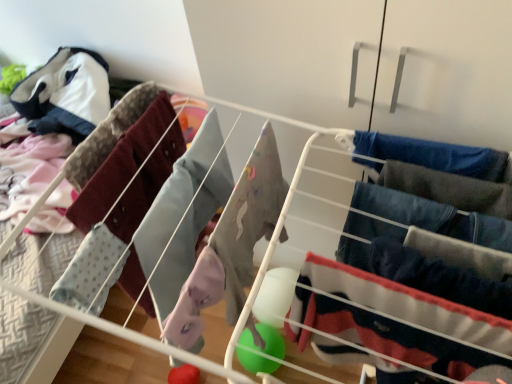
The image size is (512, 384). Describe the element at coordinates (399, 318) in the screenshot. I see `velvet navy pants at center right, placed as the 2th clothing when sorted from left to right` at that location.

You are a GUI agent. You are given a task and a screenshot of the screen. Output one action in this format:
    pyautogui.click(x=<x>, y=<y>)
    Task: Click on the velvet navy pants at center right, the 3th clothing positioned from the right
    The image size is (512, 384).
    Given the screenshot: What is the action you would take?
    [399, 318]

From the image's perspective, is denim jeans at right, which is the 3th clothing from left to right, located beneath velvet navy pants at center right, placed as the 2th clothing when sorted from left to right?

Incorrect, from the image's perspective, denim jeans at right, which is the 3th clothing from left to right, is higher than velvet navy pants at center right, placed as the 2th clothing when sorted from left to right.

From a real-world perspective, is denim jeans at right, acting as the 2th clothing starting from the right, over velvet navy pants at center right, placed as the 2th clothing when sorted from left to right?

Yes.

Could you measure the distance between denim jeans at right, which is the 3th clothing from left to right, and velvet navy pants at center right, the 3th clothing positioned from the right?

denim jeans at right, which is the 3th clothing from left to right, is 6.25 inches from velvet navy pants at center right, the 3th clothing positioned from the right.

Are denim jeans at right, which is the 3th clothing from left to right, and velvet navy pants at center right, placed as the 2th clothing when sorted from left to right, beside each other?

No, denim jeans at right, which is the 3th clothing from left to right, is not beside velvet navy pants at center right, placed as the 2th clothing when sorted from left to right.

Is dark blue fabric pants at right, which ranks as the 1th clothing in right-to-left order, oriented towards velvet navy pants at center right, placed as the 2th clothing when sorted from left to right?

Yes.

What's the angular difference between dark blue fabric pants at right, the fourth clothing positioned from the left, and velvet navy pants at center right, the 3th clothing positioned from the right,'s facing directions?

6.99e-05 degrees separate the facing orientations of dark blue fabric pants at right, the fourth clothing positioned from the left, and velvet navy pants at center right, the 3th clothing positioned from the right.

Which is nearer, (481, 298) or (415, 320)?

The point (415, 320) is closer to the camera.

From a real-world perspective, is dark blue fabric pants at right, which ranks as the 1th clothing in right-to-left order, above or below velvet navy pants at center right, placed as the 2th clothing when sorted from left to right?

dark blue fabric pants at right, which ranks as the 1th clothing in right-to-left order, is above velvet navy pants at center right, placed as the 2th clothing when sorted from left to right.

Is light blue fabric at left, which ranks as the 1th clothing in left-to-right order, smaller than dark blue fabric pants at right, the fourth clothing positioned from the left?

No, light blue fabric at left, which ranks as the 1th clothing in left-to-right order, is not smaller than dark blue fabric pants at right, the fourth clothing positioned from the left.

From a real-world perspective, which is physically above, light blue fabric at left, which ranks as the 1th clothing in left-to-right order, or dark blue fabric pants at right, the fourth clothing positioned from the left?

dark blue fabric pants at right, the fourth clothing positioned from the left, is physically above.

Between point (144, 292) and point (413, 281), which one is positioned in front?

Positioned in front is point (413, 281).

Which object is closer to the camera taking this photo, light blue fabric at left, which ranks as the 4th clothing in right-to-left order, or dark blue fabric pants at right, which ranks as the 1th clothing in right-to-left order?

dark blue fabric pants at right, which ranks as the 1th clothing in right-to-left order, is more forward.

Which point is more distant from viewer, [136,264] or [507,247]?

The point [136,264] is behind.

Can you tell me how much light blue fabric at left, which ranks as the 4th clothing in right-to-left order, and denim jeans at right, acting as the 2th clothing starting from the right, differ in facing direction?

3.75e-05 degrees.

From the image's perspective, which object appears higher, light blue fabric at left, which ranks as the 1th clothing in left-to-right order, or denim jeans at right, acting as the 2th clothing starting from the right?

denim jeans at right, acting as the 2th clothing starting from the right.

Locate an element on the screen. The height and width of the screenshot is (384, 512). the 1st clothing above the light blue fabric at left, which ranks as the 1th clothing in left-to-right order (from a real-world perspective) is located at coordinates (433, 216).

Is point (386, 305) less distant than point (161, 157)?

Yes, point (386, 305) is closer to viewer.

Is velvet navy pants at center right, placed as the 2th clothing when sorted from left to right, looking in the opposite direction of light blue fabric at left, which ranks as the 4th clothing in right-to-left order?

velvet navy pants at center right, placed as the 2th clothing when sorted from left to right, is not turned away from light blue fabric at left, which ranks as the 4th clothing in right-to-left order.

From the image's perspective, which one is positioned higher, velvet navy pants at center right, placed as the 2th clothing when sorted from left to right, or light blue fabric at left, which ranks as the 4th clothing in right-to-left order?

light blue fabric at left, which ranks as the 4th clothing in right-to-left order, appears higher in the image.

How many degrees apart are the facing directions of denim jeans at right, acting as the 2th clothing starting from the right, and light blue fabric at left, which ranks as the 4th clothing in right-to-left order?

3.75e-05 degrees.

From the image's perspective, is denim jeans at right, which is the 3th clothing from left to right, located above light blue fabric at left, which ranks as the 4th clothing in right-to-left order?

Yes.

Which is farther from the camera, [356,220] or [144,134]?

The point [144,134] is farther.

Considering the relative sizes of denim jeans at right, acting as the 2th clothing starting from the right, and light blue fabric at left, which ranks as the 1th clothing in left-to-right order, in the image provided, is denim jeans at right, acting as the 2th clothing starting from the right, taller than light blue fabric at left, which ranks as the 1th clothing in left-to-right order,?

Incorrect, the height of denim jeans at right, acting as the 2th clothing starting from the right, is not larger of that of light blue fabric at left, which ranks as the 1th clothing in left-to-right order.

Looking at this image, does light blue fabric at left, which ranks as the 1th clothing in left-to-right order, have a greater height compared to velvet navy pants at center right, placed as the 2th clothing when sorted from left to right?

No, light blue fabric at left, which ranks as the 1th clothing in left-to-right order, is not taller than velvet navy pants at center right, placed as the 2th clothing when sorted from left to right.

Which is closer, (x=169, y=149) or (x=438, y=343)?

Point (x=169, y=149) is farther from the camera than point (x=438, y=343).

From the image's perspective, does light blue fabric at left, which ranks as the 1th clothing in left-to-right order, appear lower than velvet navy pants at center right, placed as the 2th clothing when sorted from left to right?

Incorrect, from the image's perspective, light blue fabric at left, which ranks as the 1th clothing in left-to-right order, is higher than velvet navy pants at center right, placed as the 2th clothing when sorted from left to right.

Is light blue fabric at left, which ranks as the 1th clothing in left-to-right order, oriented away from velvet navy pants at center right, the 3th clothing positioned from the right?

No, light blue fabric at left, which ranks as the 1th clothing in left-to-right order, is not facing away from velvet navy pants at center right, the 3th clothing positioned from the right.

Starting from the velvet navy pants at center right, placed as the 2th clothing when sorted from left to right, which clothing is the 1st one to the right? Please provide its 2D coordinates.

[(433, 216)]

Identify the location of the 3rd clothing located beneath the dark blue fabric pants at right, which ranks as the 1th clothing in right-to-left order (from a real-world perspective). (399, 318).

Looking at the image, which one is located closer to dark blue fabric pants at right, the fourth clothing positioned from the left, light blue fabric at left, which ranks as the 4th clothing in right-to-left order, or velvet navy pants at center right, the 3th clothing positioned from the right?

velvet navy pants at center right, the 3th clothing positioned from the right.

From the image, which object appears to be farther from light blue fabric at left, which ranks as the 1th clothing in left-to-right order, velvet navy pants at center right, the 3th clothing positioned from the right, or dark blue fabric pants at right, which ranks as the 1th clothing in right-to-left order?

dark blue fabric pants at right, which ranks as the 1th clothing in right-to-left order, is positioned further to the anchor light blue fabric at left, which ranks as the 1th clothing in left-to-right order.

When comparing their distances from velvet navy pants at center right, the 3th clothing positioned from the right, does light blue fabric at left, which ranks as the 1th clothing in left-to-right order, or denim jeans at right, acting as the 2th clothing starting from the right, seem closer?

Based on the image, denim jeans at right, acting as the 2th clothing starting from the right, appears to be nearer to velvet navy pants at center right, the 3th clothing positioned from the right.

From the picture: Which object lies further to the anchor point velvet navy pants at center right, the 3th clothing positioned from the right, dark blue fabric pants at right, which ranks as the 1th clothing in right-to-left order, or light blue fabric at left, which ranks as the 1th clothing in left-to-right order?

The object further to velvet navy pants at center right, the 3th clothing positioned from the right, is light blue fabric at left, which ranks as the 1th clothing in left-to-right order.

Which object lies further to the anchor point velvet navy pants at center right, the 3th clothing positioned from the right, denim jeans at right, which is the 3th clothing from left to right, or light blue fabric at left, which ranks as the 4th clothing in right-to-left order?

light blue fabric at left, which ranks as the 4th clothing in right-to-left order, is positioned further to the anchor velvet navy pants at center right, the 3th clothing positioned from the right.

Looking at the image, which one is located further to denim jeans at right, which is the 3th clothing from left to right, dark blue fabric pants at right, which ranks as the 1th clothing in right-to-left order, or velvet navy pants at center right, placed as the 2th clothing when sorted from left to right?

velvet navy pants at center right, placed as the 2th clothing when sorted from left to right.

Based on their spatial positions, is velvet navy pants at center right, the 3th clothing positioned from the right, or denim jeans at right, acting as the 2th clothing starting from the right, closer to light blue fabric at left, which ranks as the 4th clothing in right-to-left order?

velvet navy pants at center right, the 3th clothing positioned from the right.

Considering their positions, is denim jeans at right, acting as the 2th clothing starting from the right, positioned further to light blue fabric at left, which ranks as the 1th clothing in left-to-right order, than velvet navy pants at center right, placed as the 2th clothing when sorted from left to right?

denim jeans at right, acting as the 2th clothing starting from the right, is positioned further to the anchor light blue fabric at left, which ranks as the 1th clothing in left-to-right order.

The image size is (512, 384). Identify the location of clothing between light blue fabric at left, which ranks as the 1th clothing in left-to-right order, and denim jeans at right, which is the 3th clothing from left to right. [399, 318].